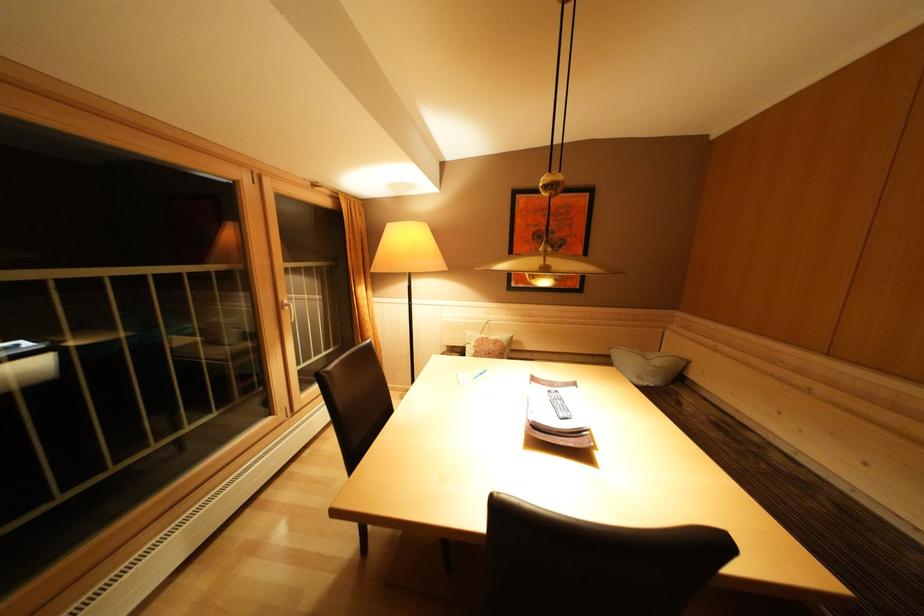
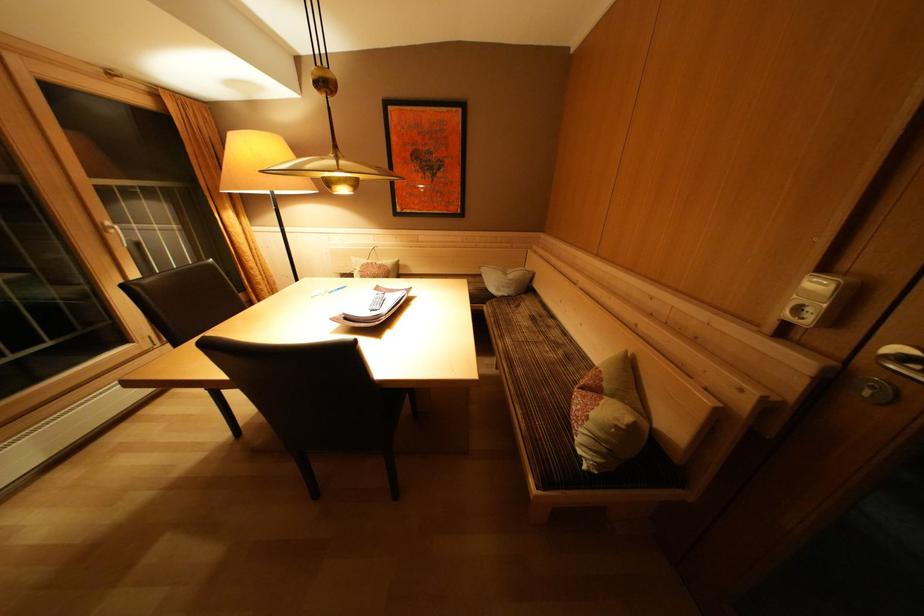
The point at (664, 368) is marked in the first image. Where is the corresponding point in the second image?

(517, 281)